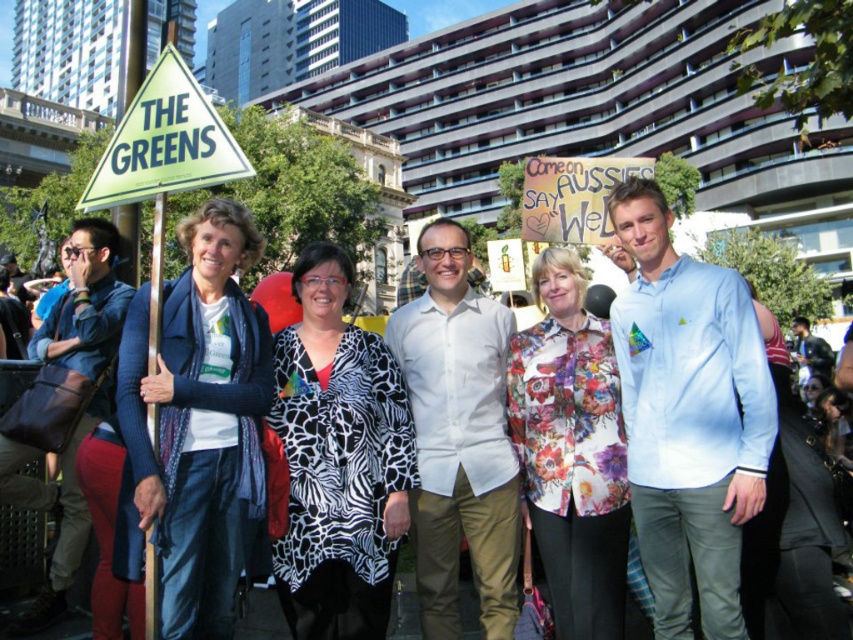
Where is the zebra print coat at center located in the image?

The zebra print coat at center is located at point (338, 460) in the image.

In the scene shown: You are a photographer trying to capture a photo of the blue woolen scarf at left and the zebra print coat at center. If you want to frame both objects in your shot without cropping either of them, which object requires more horizontal space in the frame?

The zebra print coat at center requires more horizontal space in the frame because it has a greater width than the blue woolen scarf at left.

You are a photographer taking a picture of the zebra print coat at center and the green plastic sign at upper left. Which object will appear closer to the camera in the final photo?

The zebra print coat at center will appear closer to the camera because the green plastic sign at upper left is behind it.